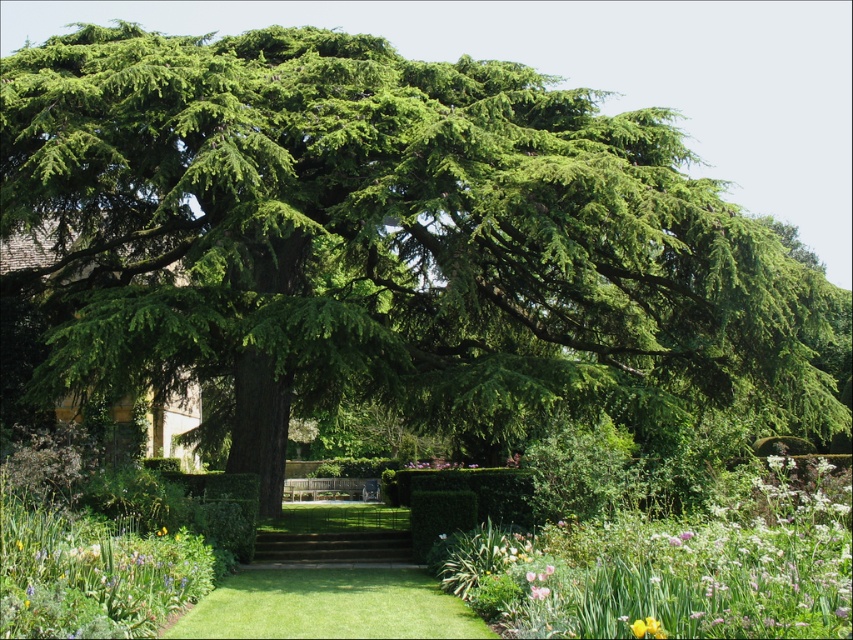
You are standing at the point with coordinates [334,548] in the garden. What object is located exactly at that point?

The brown wooden stairs at center are located exactly at point [334,548].